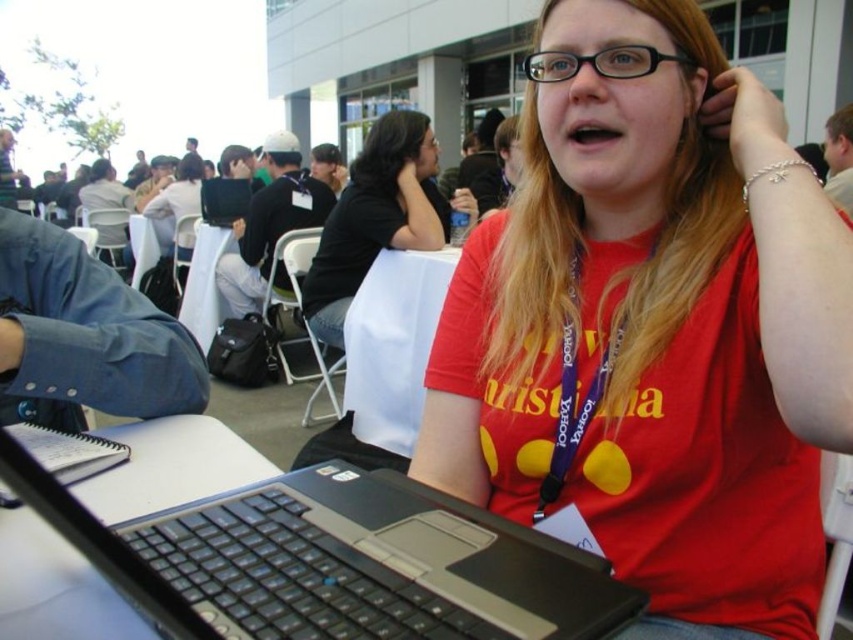
Based on the scene description, where is the black matte shirt at center located in terms of coordinates?

The black matte shirt at center is located at point coordinates of 0.339 on the x axis and 0.442 on the y axis.

You are organizing a tech conference and need to ensure that the laptop is easily accessible for presenters. Given the current arrangement, where is the black plastic laptop at center located relative to the black matte shirt at center?

The black plastic laptop at center is positioned on the right side of the black matte shirt at center, so it is to the right of the shirt.

Looking at this image, you are organizing a tech conference and need to place a new monitor on the table where the black plastic laptop at center and the black matte shirt at center are located. The monitor requires 1.2 meters of space. Can the existing space between these two items accommodate it?

The black plastic laptop at center is smaller than the black matte shirt at center, but the description does not provide specific spatial dimensions between them. Therefore, it is unclear if the 1.2 meters of space required for the monitor is available.